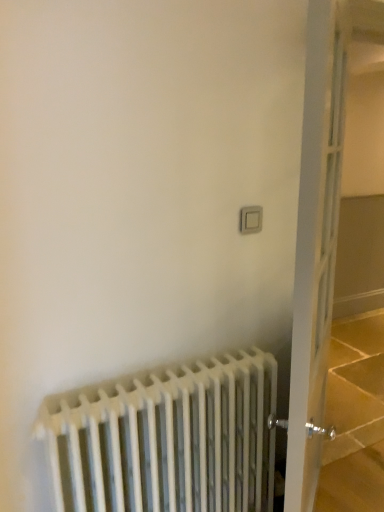
Question: Can you confirm if white glass door at right is bigger than white metal radiator at lower left?

Choices:
 (A) no
 (B) yes

Answer: (B)

Question: Is white glass door at right facing away from white metal radiator at lower left?

Choices:
 (A) no
 (B) yes

Answer: (B)

Question: Is white glass door at right directly adjacent to white metal radiator at lower left?

Choices:
 (A) no
 (B) yes

Answer: (A)

Question: Is white glass door at right not within white metal radiator at lower left?

Choices:
 (A) no
 (B) yes

Answer: (B)

Question: Does white glass door at right have a lesser width compared to white metal radiator at lower left?

Choices:
 (A) no
 (B) yes

Answer: (B)

Question: Is white glass door at right to the left of white metal radiator at lower left from the viewer's perspective?

Choices:
 (A) no
 (B) yes

Answer: (A)

Question: Does white metal radiator at lower left have a lesser height compared to white plastic switch at upper right?

Choices:
 (A) yes
 (B) no

Answer: (B)

Question: From a real-world perspective, is white metal radiator at lower left physically below white plastic switch at upper right?

Choices:
 (A) yes
 (B) no

Answer: (A)

Question: Does white metal radiator at lower left come in front of white plastic switch at upper right?

Choices:
 (A) no
 (B) yes

Answer: (B)

Question: Does white metal radiator at lower left come behind white plastic switch at upper right?

Choices:
 (A) no
 (B) yes

Answer: (A)

Question: Does white metal radiator at lower left appear on the left side of white plastic switch at upper right?

Choices:
 (A) no
 (B) yes

Answer: (B)

Question: Are white metal radiator at lower left and white plastic switch at upper right far apart?

Choices:
 (A) no
 (B) yes

Answer: (A)

Question: Does white plastic switch at upper right have a greater width compared to white metal radiator at lower left?

Choices:
 (A) no
 (B) yes

Answer: (A)